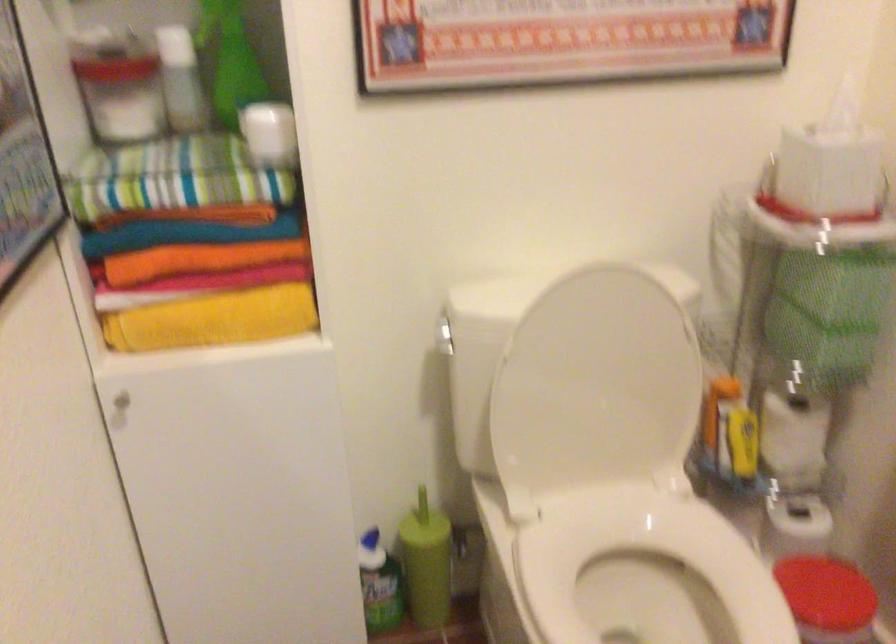
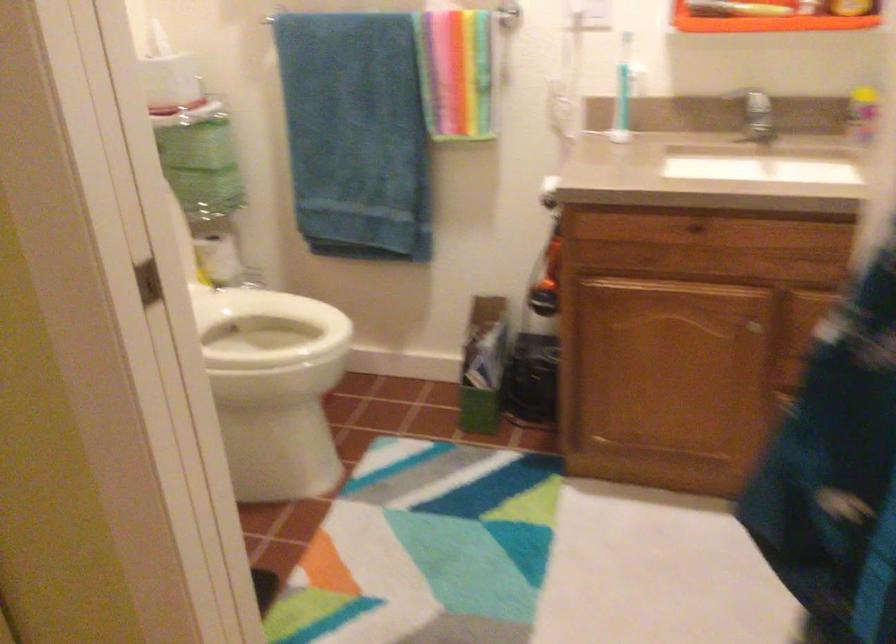
Question: I am providing you with two images of the same scene from different viewpoints. Please identify which objects are invisible in image2.

Choices:
 (A) shaker bottle cap
 (B) silver faucet handle
 (C) cabinet door knob
 (D) white toilet seat

Answer: (D)